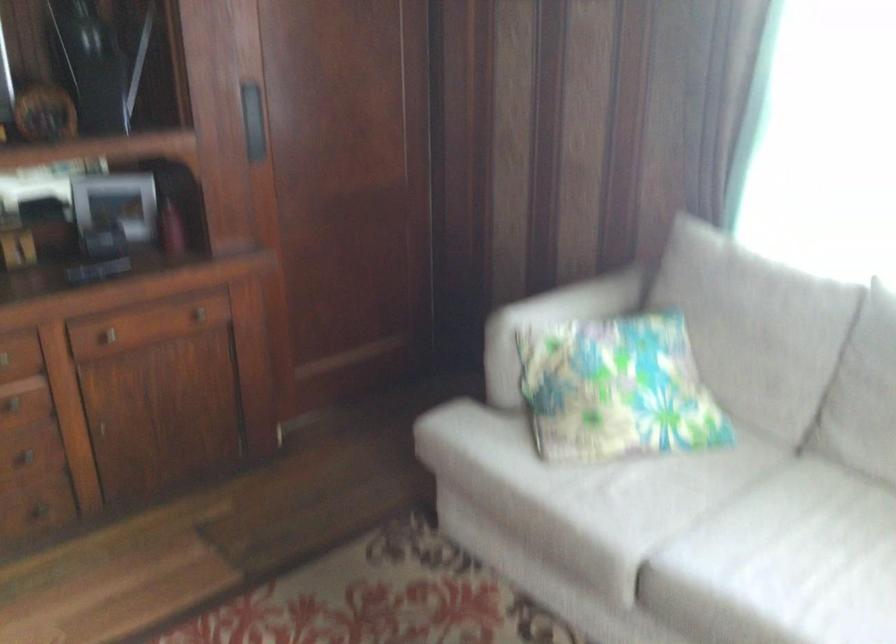
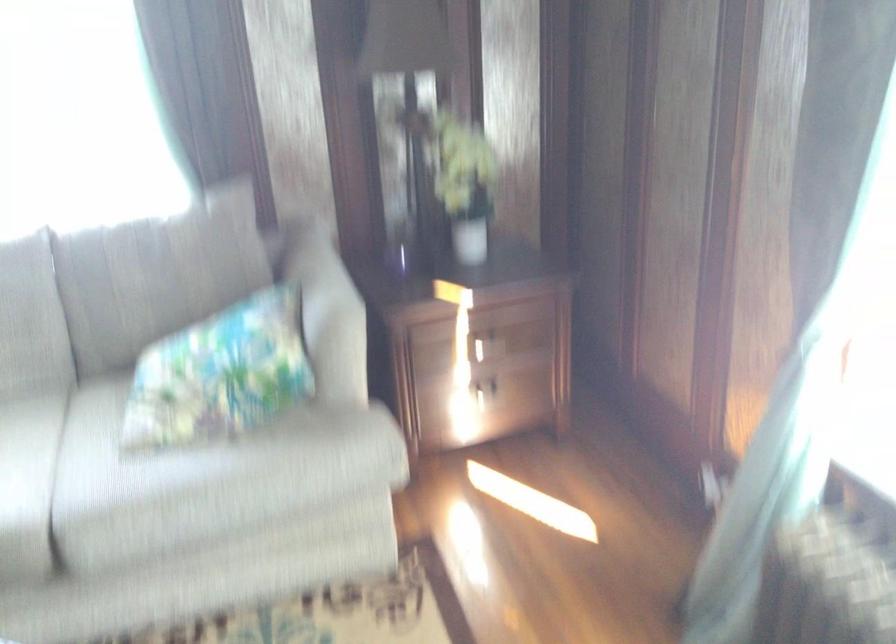
Question: The camera is either moving clockwise (left) or counter-clockwise (right) around the object. The first image is from the beginning of the video and the second image is from the end. Is the camera moving left or right when shooting the video?

Choices:
 (A) Left
 (B) Right

Answer: (A)